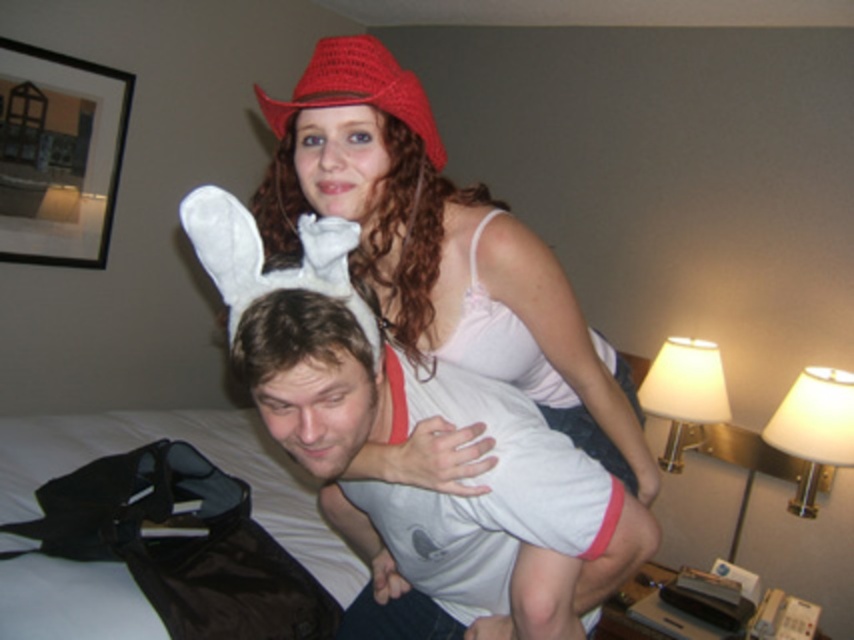
You are a photographer setting up for a photo shoot in a hotel room. You have two props to place in the scene described. The first prop is a small decorative pillow that must be placed on the larger object between the white cotton shirt at upper center and the crochet red hat at upper center. Where should you place the pillow?

The white cotton shirt at upper center is bigger than the crochet red hat at upper center, so the small decorative pillow should be placed on the white cotton shirt at upper center.

You are a photographer setting up a shoot in a hotel room. You notice two items in the scene that are both at the upper center position. Which of these two items, the white cotton shirt at upper center or the crochet red hat at upper center, would be more likely to block the camera lens if positioned closer to it?

The white cotton shirt at upper center has a greater height compared to the crochet red hat at upper center, so it would be more likely to block the camera lens if positioned closer to it.

You are taking a photo of two people in a hotel room. You notice the white cotton shirt at upper center and the crochet red hat at upper center. Which object is closer to the camera?

The white cotton shirt at upper center is closer to the viewer than the crochet red hat at upper center, so the white cotton shirt at upper center is closer to the camera.